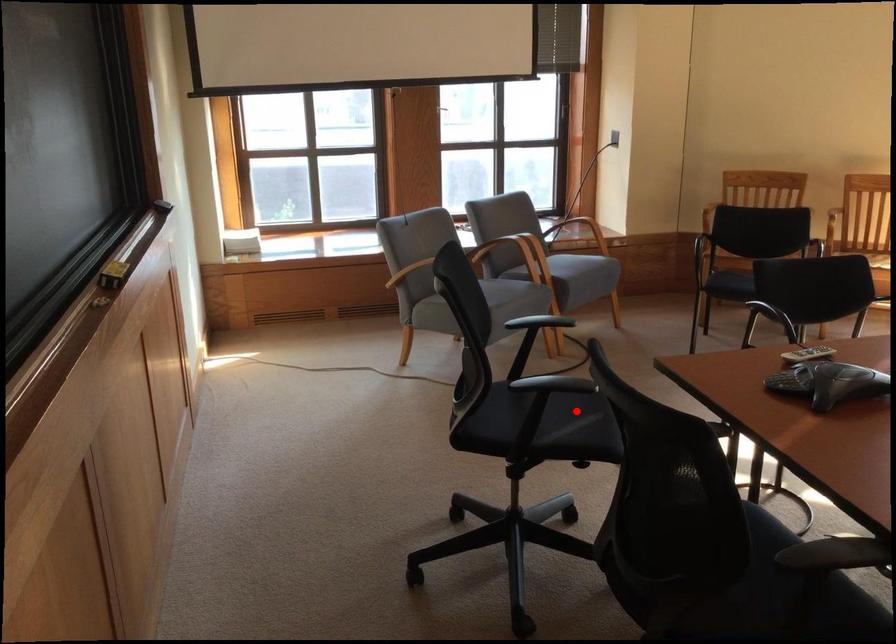
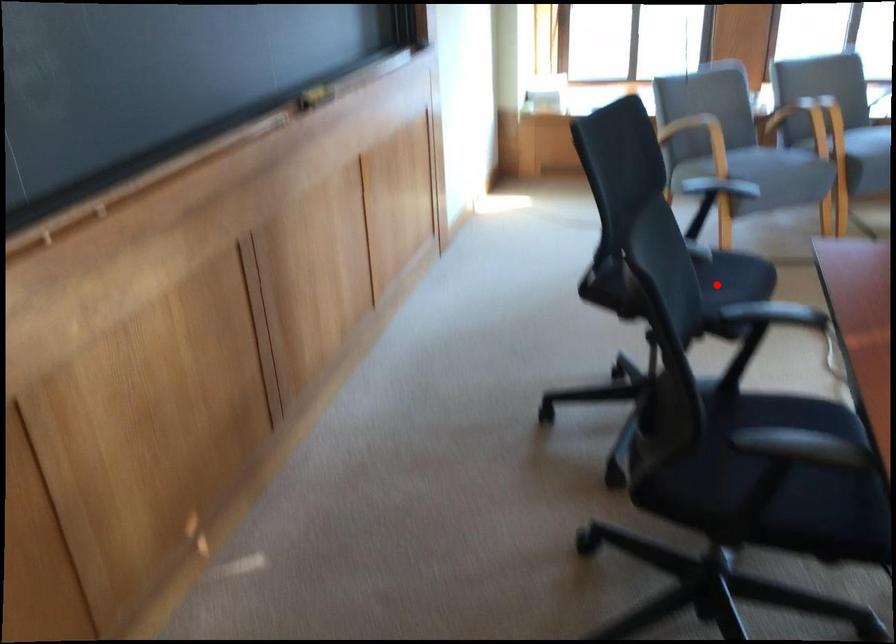
I am providing you with two images of the same scene from different viewpoints. A red point is marked on the first image and another point is marked on the second image. Are the points marked in image1 and image2 representing the same 3D position?

Yes